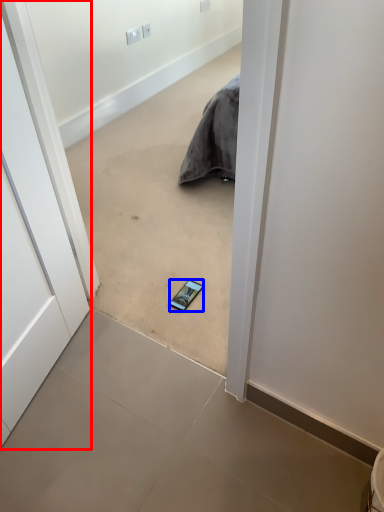
Question: Which point is closer to the camera, door (highlighted by a red box) or smartphone (highlighted by a blue box)?

Choices:
 (A) door
 (B) smartphone

Answer: (A)